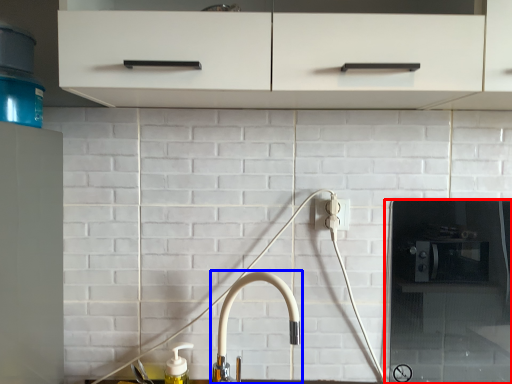
Question: Which object appears farthest to the camera in this image, appliance (highlighted by a red box) or tap (highlighted by a blue box)?

Choices:
 (A) appliance
 (B) tap

Answer: (A)